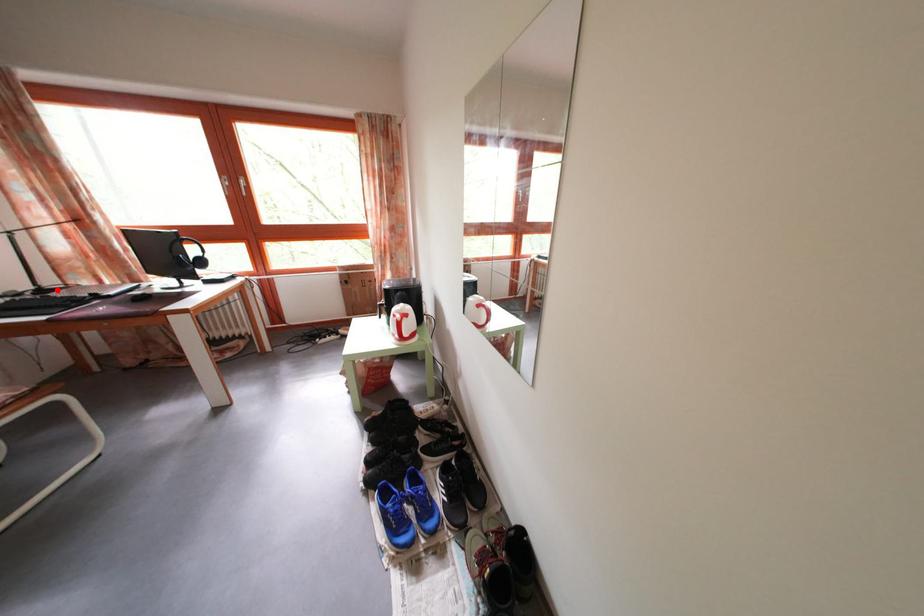
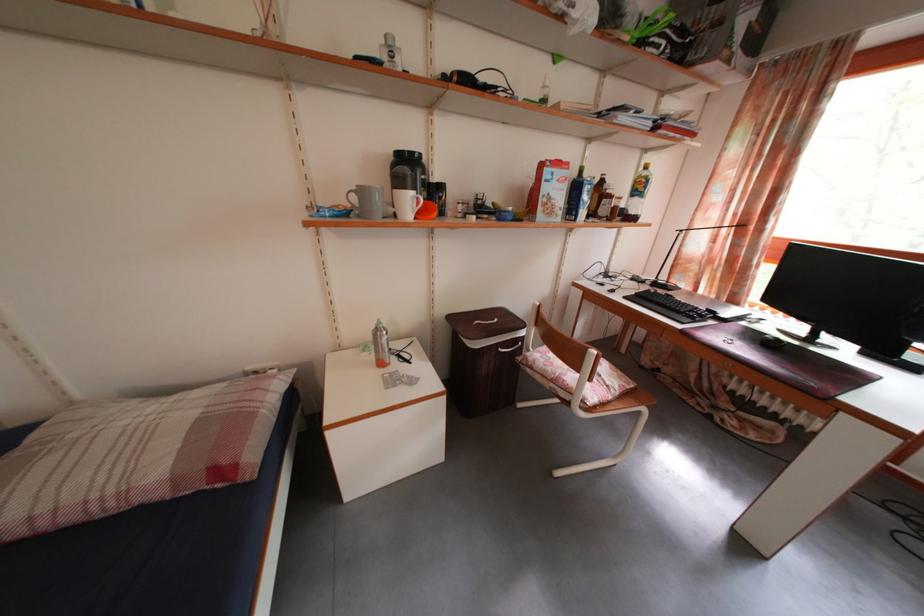
Question: I am providing you with two images of the same scene from different viewpoints. Given a red point in image1, look at the same physical point in image2. Is it:

Choices:
 (A) Closer to the viewpoint
 (B) Farther from the viewpoint

Answer: (A)